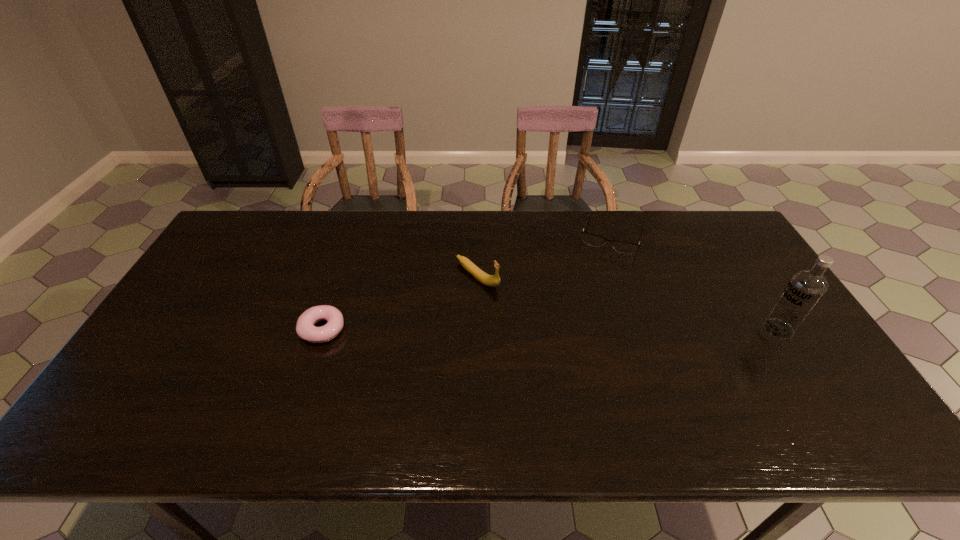
Where is `free space that satisfies the following two spatial constraints: 1. on the back side of the second object from right to left; 2. on the right side of the third nearest object`? free space that satisfies the following two spatial constraints: 1. on the back side of the second object from right to left; 2. on the right side of the third nearest object is located at coordinates (478, 235).

Identify the location of vacant space that satisfies the following two spatial constraints: 1. on the front side of the doughnut; 2. on the front label of the tallest object. (323, 329).